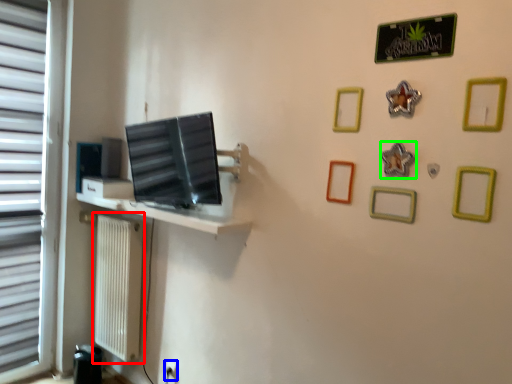
Question: Which object is positioned farthest from radiator (highlighted by a red box)? Select from electric outlet (highlighted by a blue box) and picture frame (highlighted by a green box).

Choices:
 (A) electric outlet
 (B) picture frame

Answer: (B)